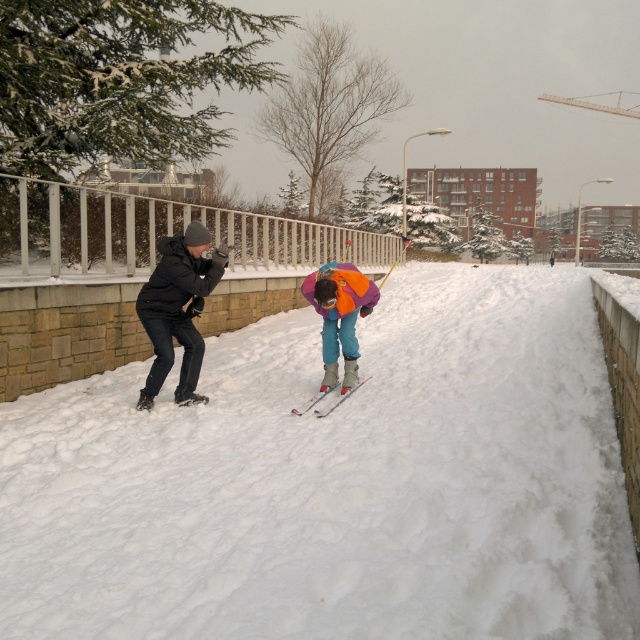
Question: Does dark gray matte jacket at left appear on the left side of metallic silver skis at center?

Choices:
 (A) yes
 (B) no

Answer: (A)

Question: Is white fluffy snow at center bigger than matte black jacket at left?

Choices:
 (A) no
 (B) yes

Answer: (B)

Question: Does matte black jacket at left have a smaller size compared to dark gray matte jacket at left?

Choices:
 (A) no
 (B) yes

Answer: (A)

Question: Which of the following is the closest to the observer?

Choices:
 (A) dark gray matte jacket at left
 (B) white fluffy snow at center

Answer: (B)

Question: Among these objects, which one is nearest to the camera?

Choices:
 (A) metallic silver skis at center
 (B) white fluffy snow at center

Answer: (B)

Question: Among these points, which one is nearest to the camera?

Choices:
 (A) (563, 266)
 (B) (154, 323)
 (C) (150, 294)
 (D) (356, 292)

Answer: (B)